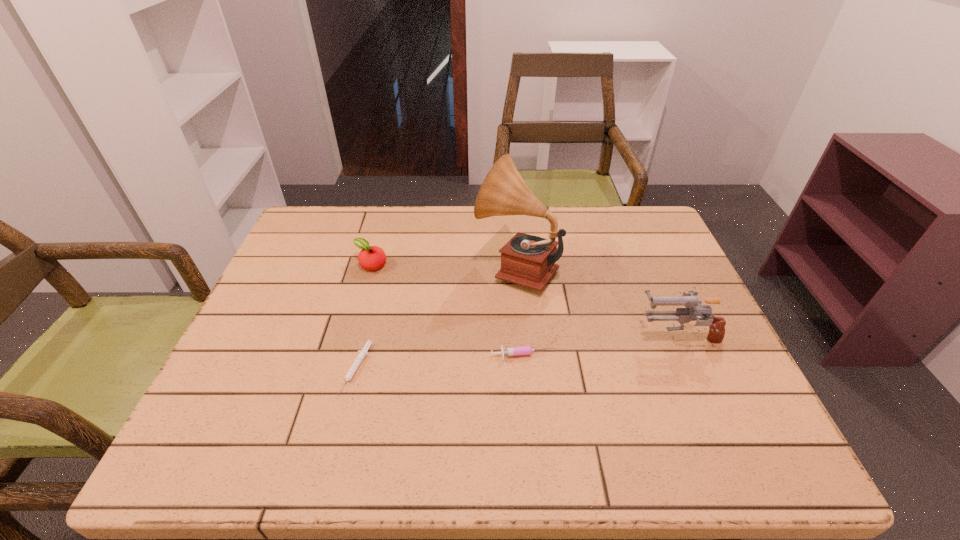
Where is `vacant region at the near edge of the desktop`? This screenshot has height=540, width=960. vacant region at the near edge of the desktop is located at coordinates pos(415,457).

The image size is (960, 540). I want to click on vacant space at the left edge of the desktop, so click(x=267, y=306).

Locate an element on the screen. vacant space at the right edge is located at coordinates [x=639, y=271].

Find the location of a particular element. free space at the far left corner is located at coordinates (319, 231).

Locate an element on the screen. The image size is (960, 540). vacant area at the near left corner is located at coordinates (204, 461).

Image resolution: width=960 pixels, height=540 pixels. Identify the location of free spot at the far right corner of the desktop. (638, 219).

You are a GUI agent. You are given a task and a screenshot of the screen. Output one action in this format:
    pyautogui.click(x=<x>, y=<y>)
    Task: Click on the free space between the gun and the phonograph record
    This screenshot has width=960, height=540.
    Given the screenshot: What is the action you would take?
    pyautogui.click(x=597, y=301)

Locate an element on the screen. free point between the gun and the apple is located at coordinates (524, 300).

Where is `free spot between the third tallest object and the shorter syringe`? The width and height of the screenshot is (960, 540). free spot between the third tallest object and the shorter syringe is located at coordinates (364, 317).

You are a GUI agent. You are given a task and a screenshot of the screen. Output one action in this format:
    pyautogui.click(x=<x>, y=<y>)
    Task: Click on the vacant space that's between the tallest object and the shortest object
    The image size is (960, 540).
    Given the screenshot: What is the action you would take?
    pyautogui.click(x=437, y=318)